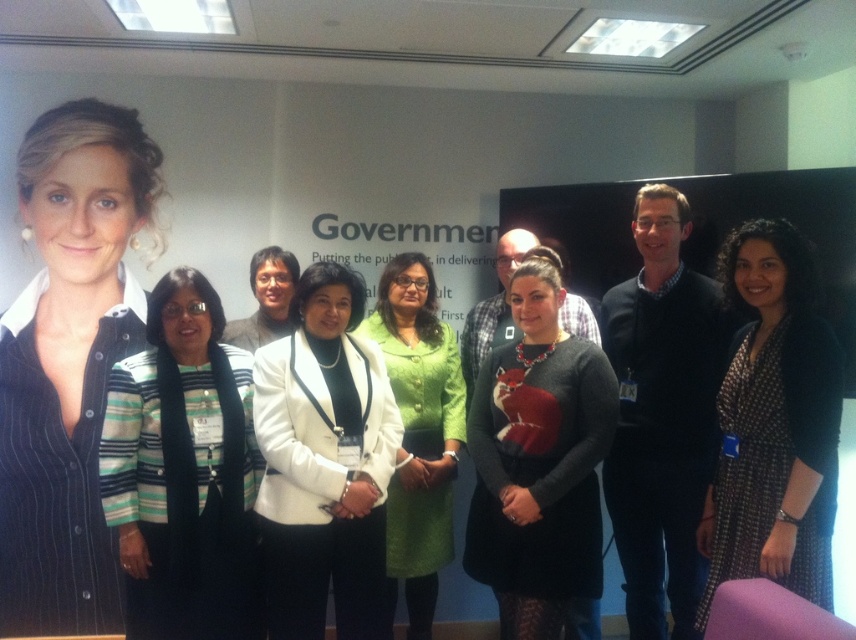
Question: Which of these objects is positioned farthest from the white matte blazer at center?

Choices:
 (A) gray sweater at center
 (B) dark blue sweater at center
 (C) striped wool sweater at center
 (D) black dotted dress at lower right

Answer: (D)

Question: Which object appears farthest from the camera in this image?

Choices:
 (A) gray sweater at center
 (B) green textured skirt at center

Answer: (B)

Question: Can you confirm if striped knit sweater at left is bigger than striped wool sweater at center?

Choices:
 (A) yes
 (B) no

Answer: (A)

Question: Where is striped knit sweater at left located in relation to green textured blazer at center in the image?

Choices:
 (A) above
 (B) below

Answer: (A)

Question: Can you confirm if striped wool sweater at center is positioned above green textured skirt at center?

Choices:
 (A) no
 (B) yes

Answer: (B)

Question: Which of the following is the farthest from the observer?

Choices:
 (A) (7, 500)
 (B) (629, 410)
 (C) (434, 323)
 (D) (137, 586)

Answer: (C)